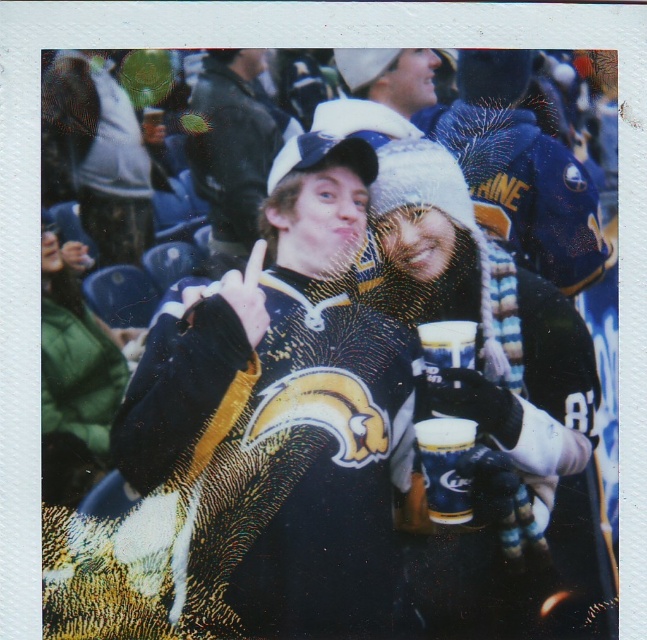
You are a photographer trying to capture a closeup of the gold metallic cup at center. However, the matte black jacket at center is blocking your view. Can you estimate whether you can move the jacket slightly to the side without moving the cup to get a clear shot?

The matte black jacket at center is larger in size than gold metallic cup at center. Since the jacket is bigger, moving it slightly to the side might be possible to reveal the cup without disturbing the cup itself.

In the scene shown: You are a photographer trying to capture a photo of the matte black jacket at center and the gold metallic cup at center. If you want to focus on the taller object, which one should you adjust your camera settings for?

The matte black jacket at center is taller than the gold metallic cup at center, so you should adjust your camera settings to focus on the matte black jacket at center.

Where is the matte black jacket at center located in the image?

The matte black jacket at center is located at point (232, 148).